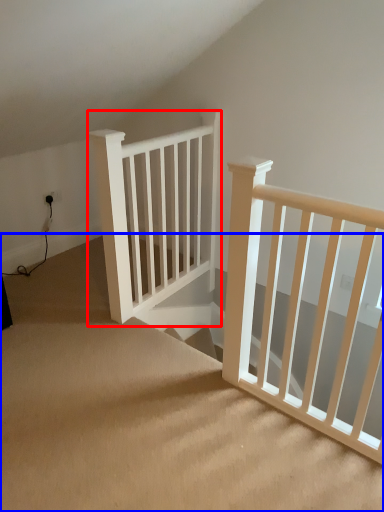
Question: Which object appears farthest to the camera in this image, rail (highlighted by a red box) or stairs (highlighted by a blue box)?

Choices:
 (A) rail
 (B) stairs

Answer: (A)